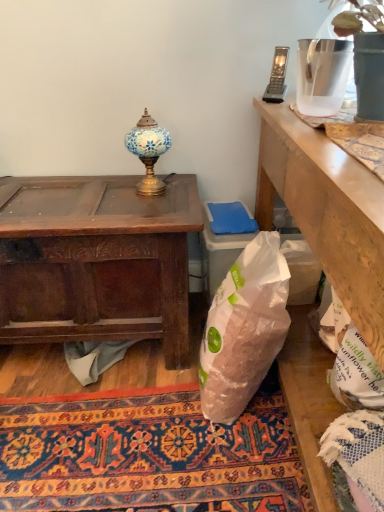
Question: Can you confirm if dark brown wood desk at left is shorter than clear plastic pitcher at upper right?

Choices:
 (A) no
 (B) yes

Answer: (A)

Question: Considering the relative sizes of dark brown wood desk at left and clear plastic pitcher at upper right in the image provided, is dark brown wood desk at left wider than clear plastic pitcher at upper right?

Choices:
 (A) yes
 (B) no

Answer: (A)

Question: Considering the relative positions of dark brown wood desk at left and clear plastic pitcher at upper right in the image provided, is dark brown wood desk at left behind clear plastic pitcher at upper right?

Choices:
 (A) no
 (B) yes

Answer: (B)

Question: Is dark brown wood desk at left far away from clear plastic pitcher at upper right?

Choices:
 (A) yes
 (B) no

Answer: (B)

Question: Considering the relative sizes of dark brown wood desk at left and clear plastic pitcher at upper right in the image provided, is dark brown wood desk at left smaller than clear plastic pitcher at upper right?

Choices:
 (A) yes
 (B) no

Answer: (B)

Question: Considering the positions of clear plastic pitcher at upper right and gray plastic phone at upper right in the image, is clear plastic pitcher at upper right bigger or smaller than gray plastic phone at upper right?

Choices:
 (A) small
 (B) big

Answer: (B)

Question: From a real-world perspective, is clear plastic pitcher at upper right physically located above or below gray plastic phone at upper right?

Choices:
 (A) below
 (B) above

Answer: (B)

Question: Considering their positions, is clear plastic pitcher at upper right located in front of or behind gray plastic phone at upper right?

Choices:
 (A) behind
 (B) front

Answer: (B)

Question: Is clear plastic pitcher at upper right wider or thinner than gray plastic phone at upper right?

Choices:
 (A) thin
 (B) wide

Answer: (B)

Question: Relative to gray plastic phone at upper right, is mosaic glass lamp at upper center in front or behind?

Choices:
 (A) behind
 (B) front

Answer: (A)

Question: Looking at their shapes, would you say mosaic glass lamp at upper center is wider or thinner than gray plastic phone at upper right?

Choices:
 (A) thin
 (B) wide

Answer: (B)

Question: Is mosaic glass lamp at upper center taller or shorter than gray plastic phone at upper right?

Choices:
 (A) tall
 (B) short

Answer: (A)

Question: Does point (132, 130) appear closer or farther from the camera than point (264, 97)?

Choices:
 (A) closer
 (B) farther

Answer: (B)

Question: From a real-world perspective, is carpeted rug at center physically located above or below dark brown wood desk at left?

Choices:
 (A) above
 (B) below

Answer: (B)

Question: Is carpeted rug at center bigger or smaller than dark brown wood desk at left?

Choices:
 (A) small
 (B) big

Answer: (A)